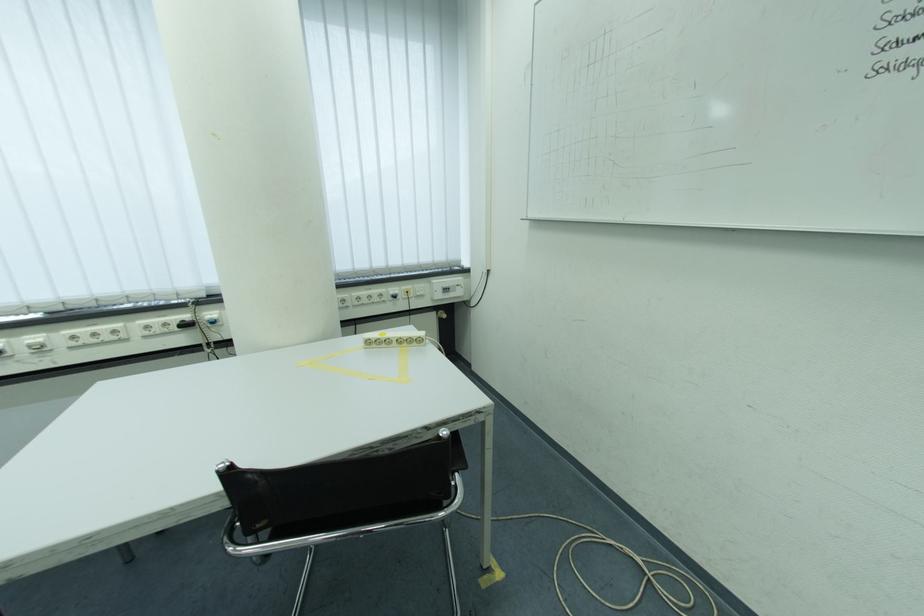
This screenshot has width=924, height=616. Describe the element at coordinates (341, 522) in the screenshot. I see `the chair sitting surface` at that location.